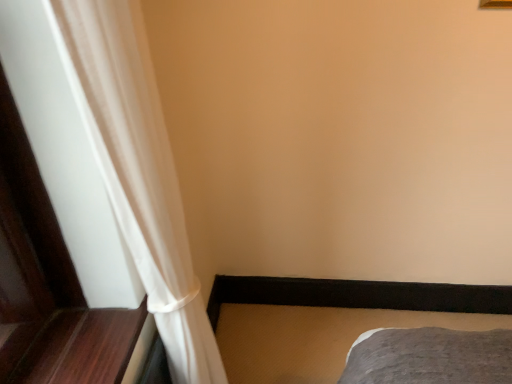
The width and height of the screenshot is (512, 384). Find the location of `free space above gray fabric bed frame at lower right (from a real-world perspective)`. free space above gray fabric bed frame at lower right (from a real-world perspective) is located at coordinates (313, 342).